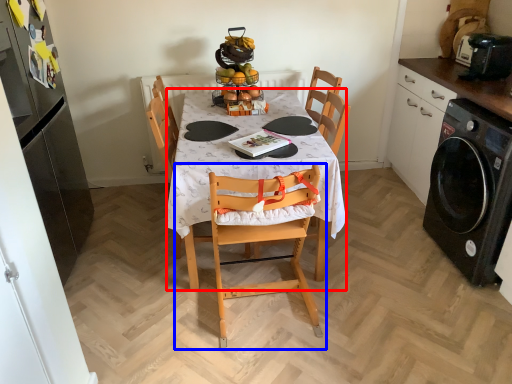
Question: Which object is closer to the camera taking this photo, desk (highlighted by a red box) or chair (highlighted by a blue box)?

Choices:
 (A) desk
 (B) chair

Answer: (B)